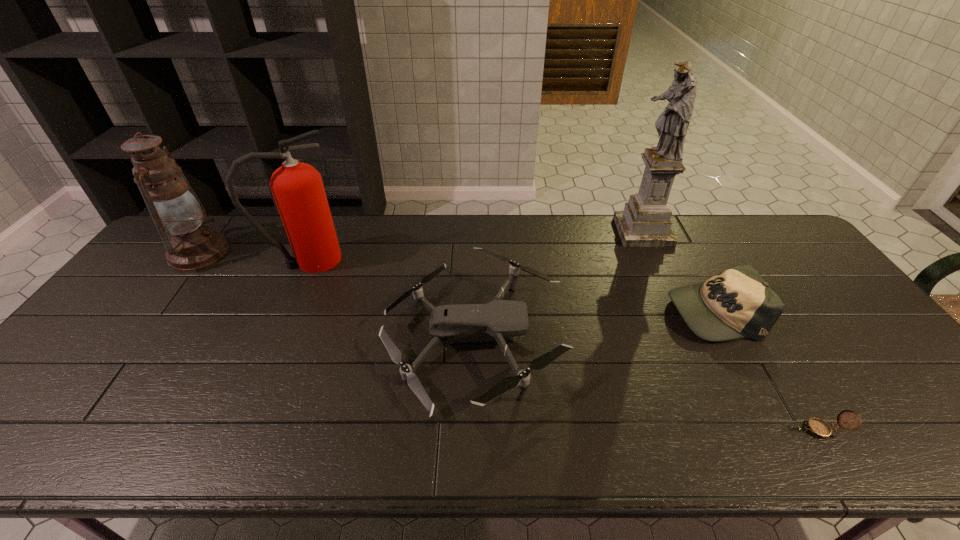
The image size is (960, 540). I want to click on the tallest object, so click(645, 222).

At what (x,y) coordinates should I click in order to perform the action: click on the second object from left to right. Please return your answer as a coordinate pair (x, y). Looking at the image, I should click on (298, 190).

Locate an element on the screen. the leftmost object is located at coordinates (191, 244).

You are a GUI agent. You are given a task and a screenshot of the screen. Output one action in this format:
    pyautogui.click(x=<x>, y=<y>)
    Task: Click on the fourth object from right to left
    
    Given the screenshot: What is the action you would take?
    pyautogui.click(x=493, y=321)

At what (x,y) coordinates should I click in order to perform the action: click on baseball cap. Please return your answer as a coordinate pair (x, y). Looking at the image, I should click on (736, 303).

The image size is (960, 540). I want to click on the shortest object, so click(820, 429).

You are a GUI agent. You are given a task and a screenshot of the screen. Output one action in this format:
    pyautogui.click(x=<x>, y=<y>)
    Task: Click on the blank area located on the front-facing side of the tallest object
    The height and width of the screenshot is (540, 960).
    Given the screenshot: What is the action you would take?
    pyautogui.click(x=568, y=232)

Find the location of a particular element. free space located 0.340m on the front-facing side of the tallest object is located at coordinates (518, 232).

At what (x,y) coordinates should I click in order to perform the action: click on free region located 0.250m on the front-facing side of the tallest object. Please return your answer as a coordinate pair (x, y). This screenshot has width=960, height=540. Looking at the image, I should click on (545, 232).

Where is `vacant area situated on the handle side of the fifth object from right to left`? This screenshot has width=960, height=540. vacant area situated on the handle side of the fifth object from right to left is located at coordinates (431, 260).